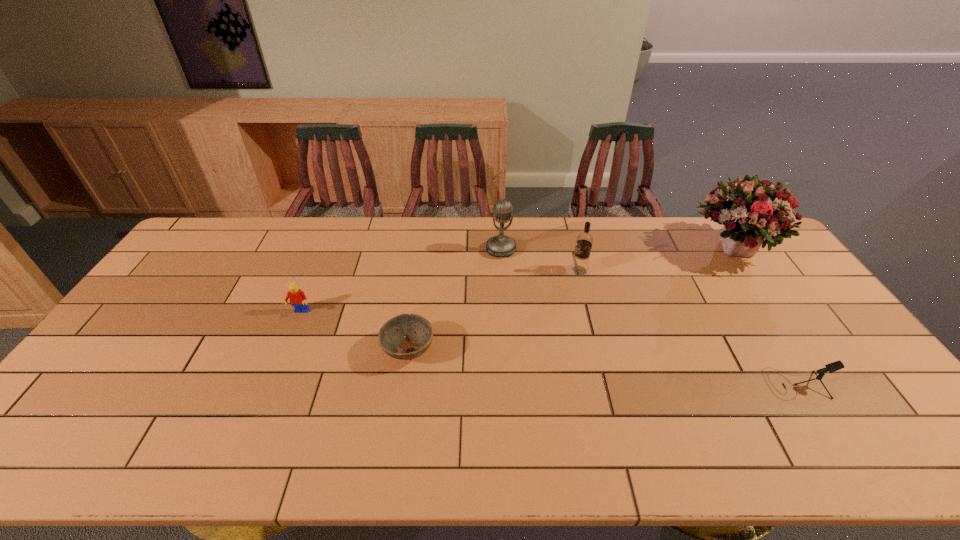
Where is `object identified as the third closest to the bowl`? object identified as the third closest to the bowl is located at coordinates pos(584,241).

Where is `free point that satisfies the following two spatial constraints: 1. on the back side of the tallest object; 2. on the right side of the fifth object from right to left`? This screenshot has height=540, width=960. free point that satisfies the following two spatial constraints: 1. on the back side of the tallest object; 2. on the right side of the fifth object from right to left is located at coordinates (423, 249).